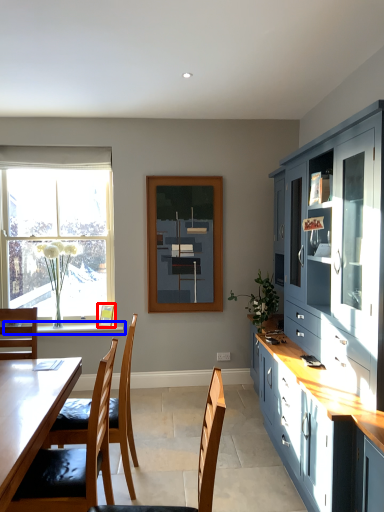
Question: Which object is closer to the camera taking this photo, picture frame (highlighted by a red box) or window sill (highlighted by a blue box)?

Choices:
 (A) picture frame
 (B) window sill

Answer: (B)